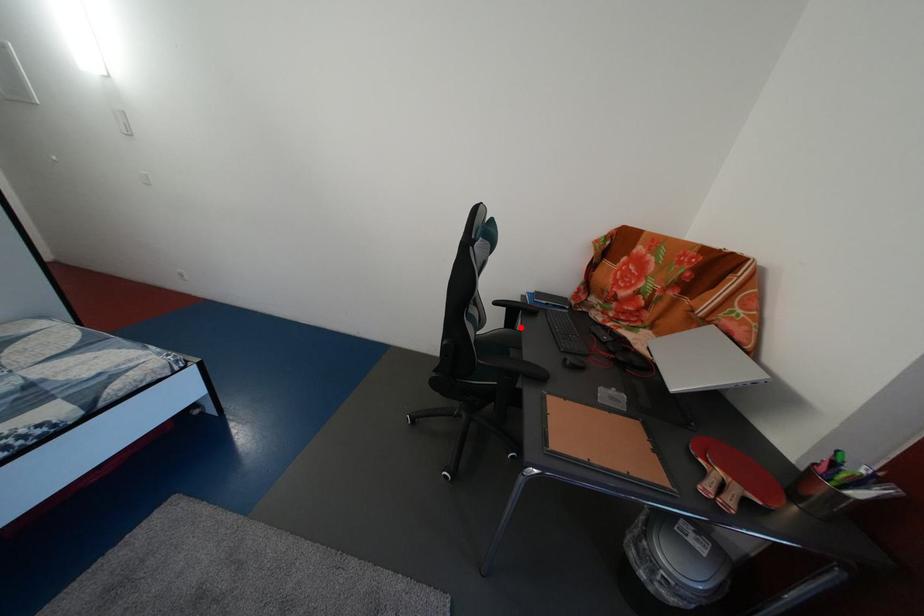
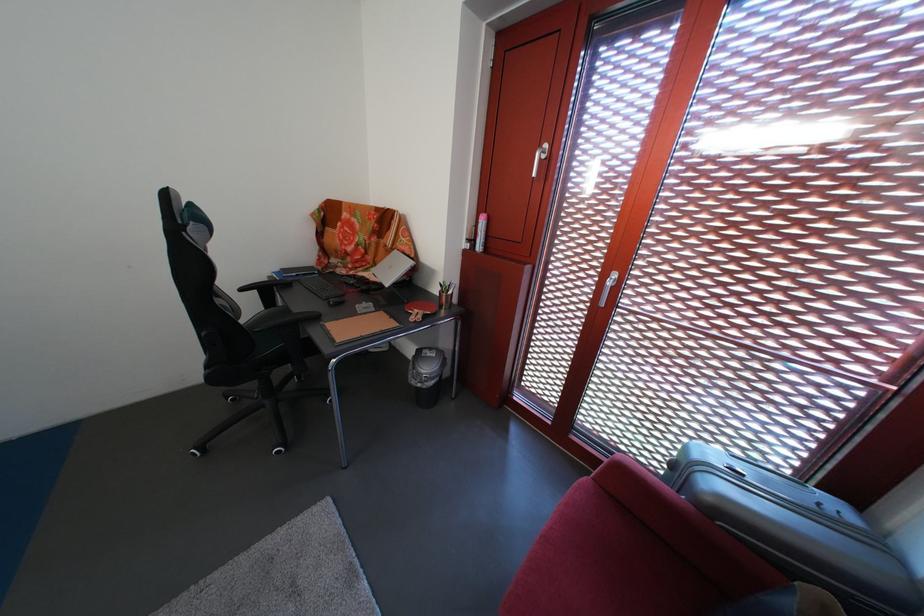
Question: I am providing you with two images of the same scene from different viewpoints. A red point is shown in image1. For the corresponding object point in image2, is it positioned nearer or farther from the camera?

Choices:
 (A) Nearer
 (B) Farther

Answer: (B)